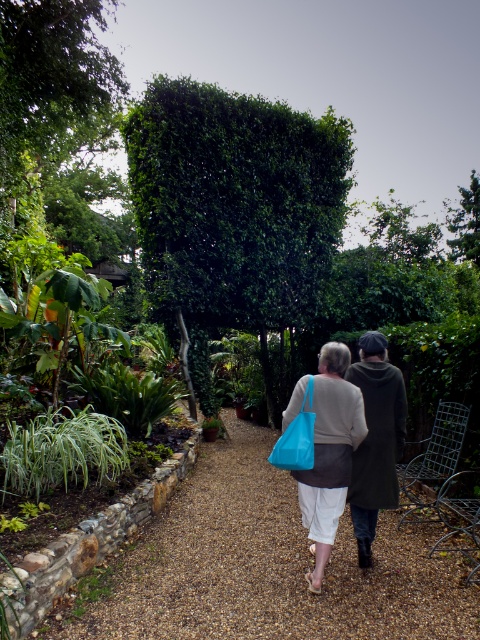
Question: Can you confirm if green leafy hedge at center is positioned above dark green coat at center?

Choices:
 (A) no
 (B) yes

Answer: (B)

Question: Can you confirm if brown gravel path at center is thinner than green leafy hedge at center?

Choices:
 (A) no
 (B) yes

Answer: (B)

Question: Is green leafy hedge at center thinner than blue fabric bag at center?

Choices:
 (A) no
 (B) yes

Answer: (A)

Question: Based on their relative distances, which object is farther from the green leafy hedge at center?

Choices:
 (A) matte blue bag at center
 (B) blue fabric bag at center

Answer: (B)

Question: Which point is closer to the camera?

Choices:
 (A) (327, 477)
 (B) (288, 460)
 (C) (244, 444)
 (D) (359, 353)

Answer: (B)

Question: Among these objects, which one is nearest to the camera?

Choices:
 (A) blue fabric bag at center
 (B) matte blue bag at center
 (C) brown gravel path at center
 (D) dark green coat at center

Answer: (C)